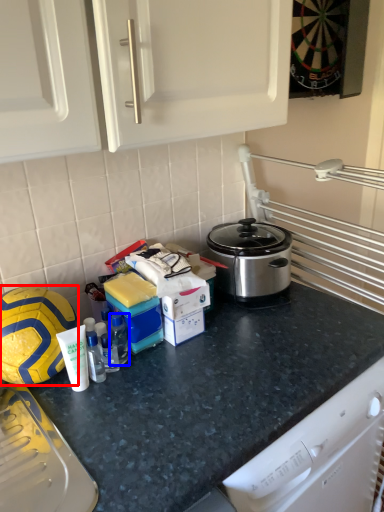
Question: Which object appears farthest to the camera in this image, football (highlighted by a red box) or bottle (highlighted by a blue box)?

Choices:
 (A) football
 (B) bottle

Answer: (B)